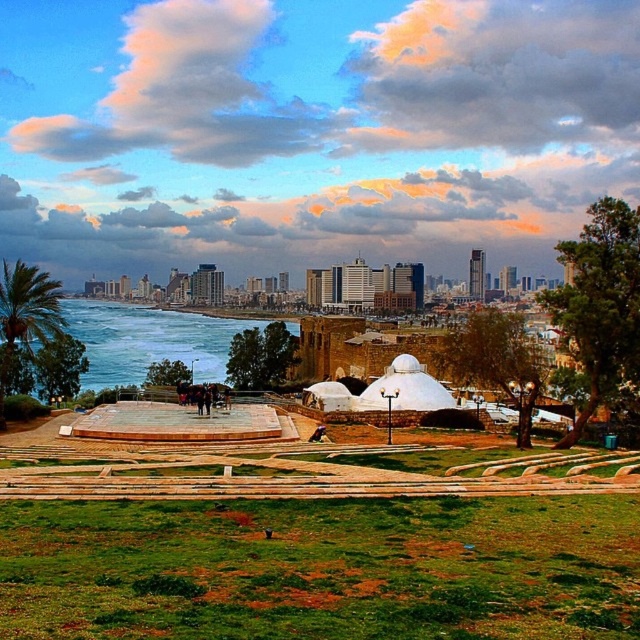
Is point (179, 320) positioned behind point (33, 269)?

Yes, point (179, 320) is behind point (33, 269).

Can you confirm if blue ocean water at lower left is shorter than green leafy palm tree at left?

Incorrect, blue ocean water at lower left's height does not fall short of green leafy palm tree at left's.

Does point (236, 324) come behind point (36, 284)?

Yes, point (236, 324) is farther from viewer.

At what (x,y) coordinates should I click in order to perform the action: click on blue ocean water at lower left. Please return your answer as a coordinate pair (x, y). This screenshot has width=640, height=640. Looking at the image, I should click on (148, 339).